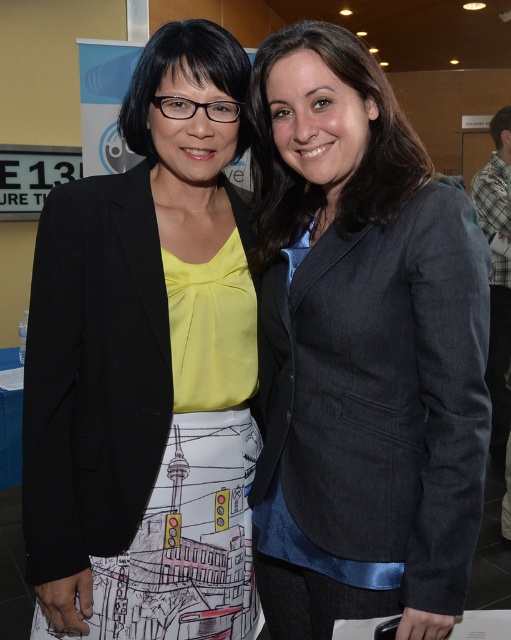
Does dark gray textured blazer at center have a greater height compared to matte black blazer at center?

In fact, dark gray textured blazer at center may be shorter than matte black blazer at center.

Is dark gray textured blazer at center further to the viewer compared to matte black blazer at center?

No.

Is point (304, 38) positioned before point (217, 97)?

Yes, it is in front of point (217, 97).

This screenshot has width=511, height=640. I want to click on dark gray textured blazer at center, so click(361, 349).